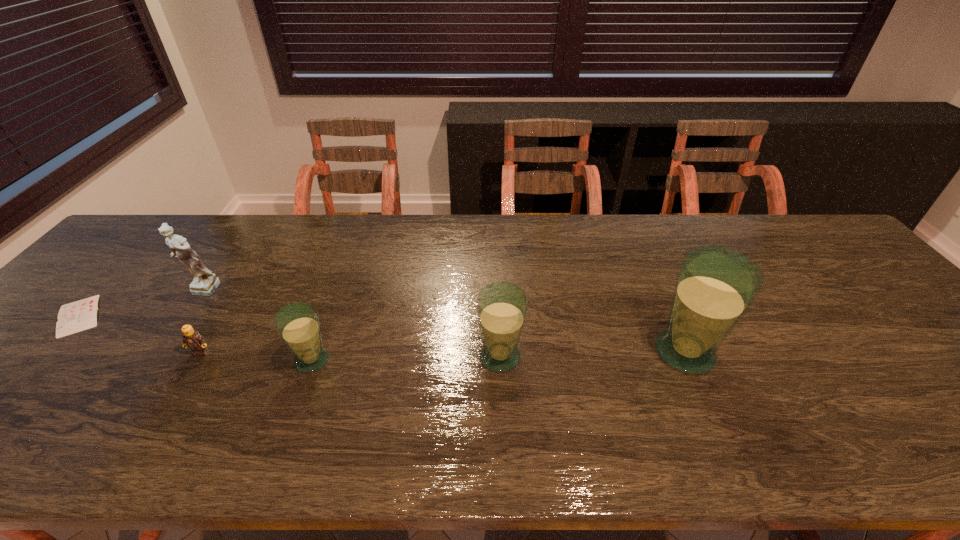
Locate an element on the screen. the third object from right to left is located at coordinates (297, 323).

The height and width of the screenshot is (540, 960). I want to click on the third shortest object, so click(297, 323).

Locate an element on the screen. the third tallest object is located at coordinates (502, 307).

The height and width of the screenshot is (540, 960). Find the location of `the second tallest glass`. the second tallest glass is located at coordinates (502, 307).

The image size is (960, 540). Identify the location of the tallest glass. (715, 286).

Where is `the rightmost object`? the rightmost object is located at coordinates (715, 286).

Where is `the fifth shortest object`? This screenshot has width=960, height=540. the fifth shortest object is located at coordinates (205, 283).

The height and width of the screenshot is (540, 960). In order to click on figurine in this screenshot , I will do `click(205, 283)`.

I want to click on diary, so click(x=74, y=317).

I want to click on the shortest object, so click(74, 317).